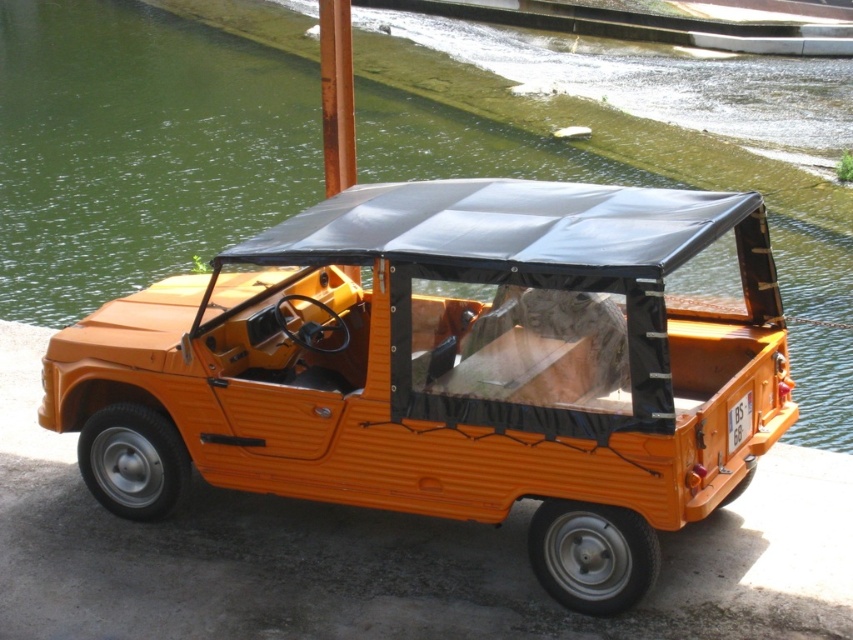
Question: Is orange matte car at center positioned behind green water at center?

Choices:
 (A) yes
 (B) no

Answer: (B)

Question: Can you confirm if orange matte car at center is positioned below green water at center?

Choices:
 (A) yes
 (B) no

Answer: (A)

Question: Which point is closer to the camera?

Choices:
 (A) orange matte car at center
 (B) green water at center

Answer: (A)

Question: Which point is farther to the camera?

Choices:
 (A) (187, 157)
 (B) (666, 376)

Answer: (A)

Question: Does orange matte car at center appear on the left side of green water at center?

Choices:
 (A) yes
 (B) no

Answer: (A)